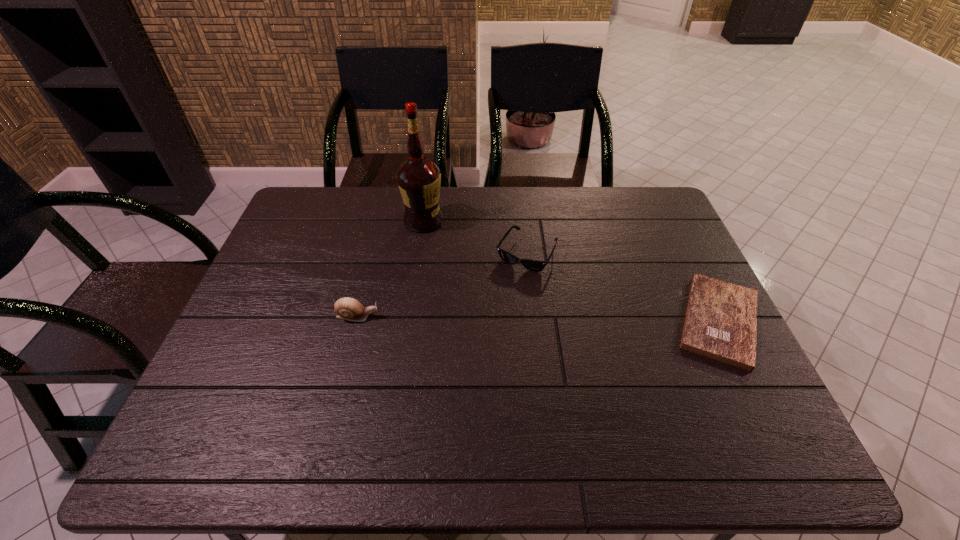
Identify the location of vacant point located 0.370m on the front-facing side of the sunglasses. The image size is (960, 540). (455, 373).

This screenshot has width=960, height=540. Find the location of `vacant region located 0.080m on the front-facing side of the sunglasses`. vacant region located 0.080m on the front-facing side of the sunglasses is located at coordinates (504, 291).

Where is `free region located 0.310m on the front-facing side of the sunglasses`? free region located 0.310m on the front-facing side of the sunglasses is located at coordinates (467, 353).

The height and width of the screenshot is (540, 960). I want to click on vacant space located 0.280m on the label of the tallest object, so click(x=476, y=287).

Locate an element on the screen. The height and width of the screenshot is (540, 960). free space located on the label of the tallest object is located at coordinates (490, 304).

Where is `free space located on the label of the tallest object`? The height and width of the screenshot is (540, 960). free space located on the label of the tallest object is located at coordinates (478, 290).

At what (x,y) coordinates should I click in order to perform the action: click on object at the far edge. Please return your answer as a coordinate pair (x, y). Looking at the image, I should click on (419, 179).

I want to click on object at the right edge, so click(x=721, y=319).

Image resolution: width=960 pixels, height=540 pixels. I want to click on blank area at the far edge, so click(x=397, y=198).

In the image, there is a desktop. In order to click on vacant space at the near edge in this screenshot , I will do `click(603, 414)`.